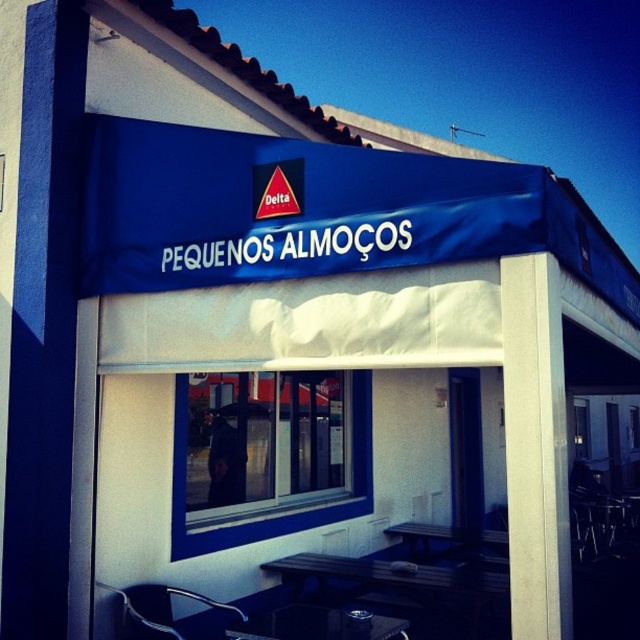
Which is more to the right, black wood table at lower center or metallic silver table at lower center?

Positioned to the right is black wood table at lower center.

Between black wood table at lower center and metallic silver table at lower center, which one appears on the left side from the viewer's perspective?

From the viewer's perspective, metallic silver table at lower center appears more on the left side.

Between point (467, 577) and point (282, 612), which one is positioned in front?

Point (282, 612) is in front.

Identify the location of black wood table at lower center. The image size is (640, 640). (397, 577).

Identify the location of white smooth pillar at center. (536, 448).

Is white smooth pillar at center in front of black wood table at lower center?

Yes, it is in front of black wood table at lower center.

Image resolution: width=640 pixels, height=640 pixels. Find the location of `white smooth pillar at center`. white smooth pillar at center is located at coordinates (536, 448).

Locate an element on the screen. white smooth pillar at center is located at coordinates (536, 448).

Is white smooth pillar at center wider than metallic silver table at lower center?

No, white smooth pillar at center is not wider than metallic silver table at lower center.

Is white smooth pillar at center below metallic silver table at lower center?

Actually, white smooth pillar at center is above metallic silver table at lower center.

Does point (557, 486) come in front of point (369, 628)?

Yes, point (557, 486) is in front of point (369, 628).

The width and height of the screenshot is (640, 640). What are the coordinates of `white smooth pillar at center` in the screenshot? It's located at (536, 448).